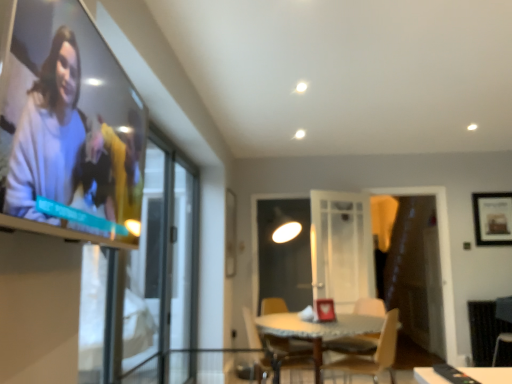
Question: Does clear glass table at center lie behind matte white sweater at upper left?

Choices:
 (A) yes
 (B) no

Answer: (A)

Question: Is clear glass table at center shorter than matte white sweater at upper left?

Choices:
 (A) yes
 (B) no

Answer: (B)

Question: Is clear glass table at center positioned far away from matte white sweater at upper left?

Choices:
 (A) no
 (B) yes

Answer: (B)

Question: Is matte white sweater at upper left completely or partially inside clear glass table at center?

Choices:
 (A) yes
 (B) no

Answer: (B)

Question: Is clear glass table at center facing towards matte white sweater at upper left?

Choices:
 (A) no
 (B) yes

Answer: (A)

Question: Does clear glass table at center have a lesser width compared to matte white sweater at upper left?

Choices:
 (A) no
 (B) yes

Answer: (A)

Question: From a real-world perspective, does wooden framed picture at upper right sit lower than matte white sweater at upper left?

Choices:
 (A) no
 (B) yes

Answer: (A)

Question: Is matte white sweater at upper left inside wooden framed picture at upper right?

Choices:
 (A) yes
 (B) no

Answer: (B)

Question: Is wooden framed picture at upper right facing towards matte white sweater at upper left?

Choices:
 (A) no
 (B) yes

Answer: (A)

Question: Can you confirm if wooden framed picture at upper right is positioned to the right of matte white sweater at upper left?

Choices:
 (A) yes
 (B) no

Answer: (A)

Question: Does wooden framed picture at upper right come in front of matte white sweater at upper left?

Choices:
 (A) yes
 (B) no

Answer: (B)

Question: Can you confirm if wooden framed picture at upper right is wider than matte white sweater at upper left?

Choices:
 (A) no
 (B) yes

Answer: (A)

Question: Can you see transparent glass screen door at left, acting as the 1th screen door starting from the front, touching matte white sweater at upper left?

Choices:
 (A) yes
 (B) no

Answer: (B)